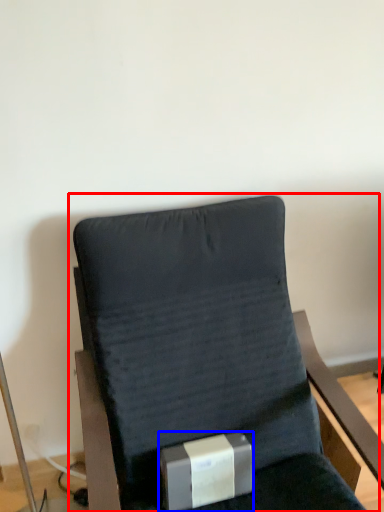
Question: Which object is further to the camera taking this photo, chair (highlighted by a red box) or box (highlighted by a blue box)?

Choices:
 (A) chair
 (B) box

Answer: (B)